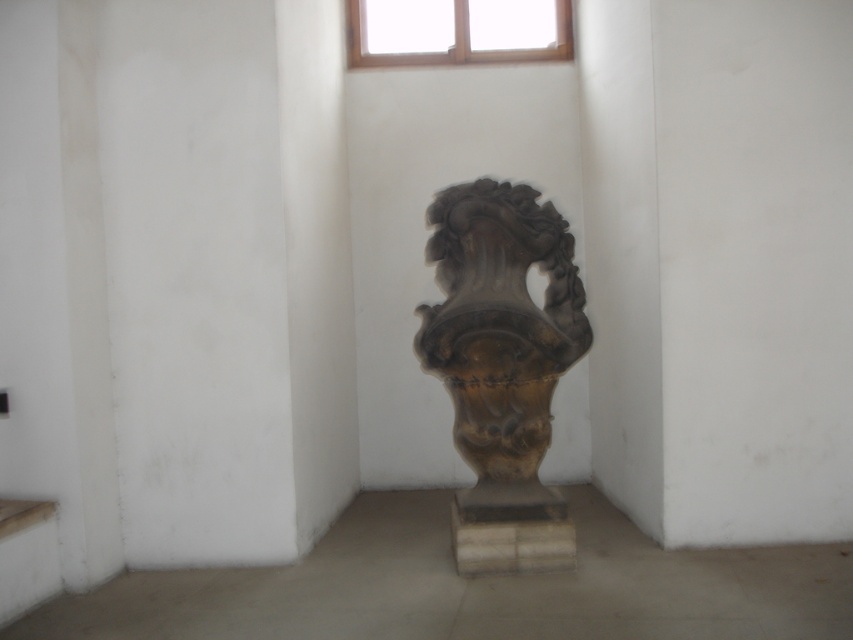
Question: Which object appears farthest from the camera in this image?

Choices:
 (A) wooden frame at upper center
 (B) brown stone vase at center

Answer: (A)

Question: From the image, what is the correct spatial relationship of brown stone vase at center in relation to wooden frame at upper center?

Choices:
 (A) above
 (B) below

Answer: (B)

Question: Is brown stone vase at center to the right of wooden frame at upper center from the viewer's perspective?

Choices:
 (A) yes
 (B) no

Answer: (A)

Question: Which point is farther to the camera?

Choices:
 (A) (526, 209)
 (B) (514, 51)

Answer: (B)

Question: Does brown stone vase at center have a smaller size compared to wooden frame at upper center?

Choices:
 (A) yes
 (B) no

Answer: (B)